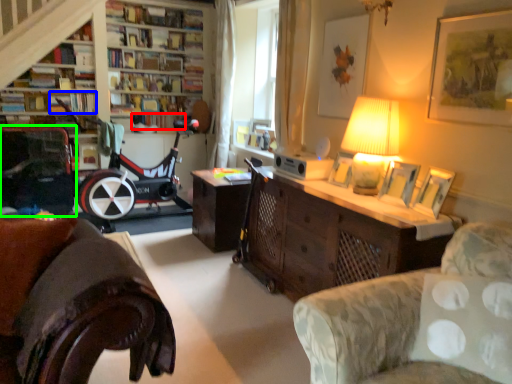
Question: Estimate the real-world distances between objects in this image. Which object is farther from book (highlighted by a red box), book (highlighted by a blue box) or armchair (highlighted by a green box)?

Choices:
 (A) book
 (B) armchair

Answer: (B)